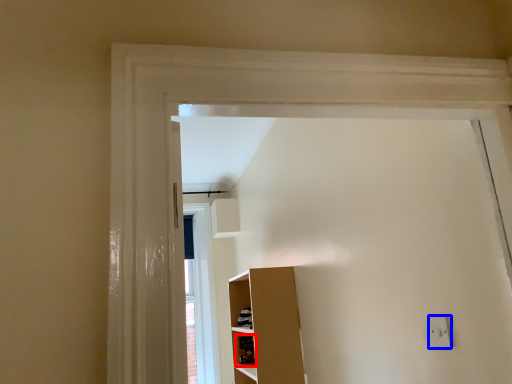
Question: Which object is closer to the camera taking this photo, cabinet (highlighted by a red box) or electric outlet (highlighted by a blue box)?

Choices:
 (A) cabinet
 (B) electric outlet

Answer: (B)